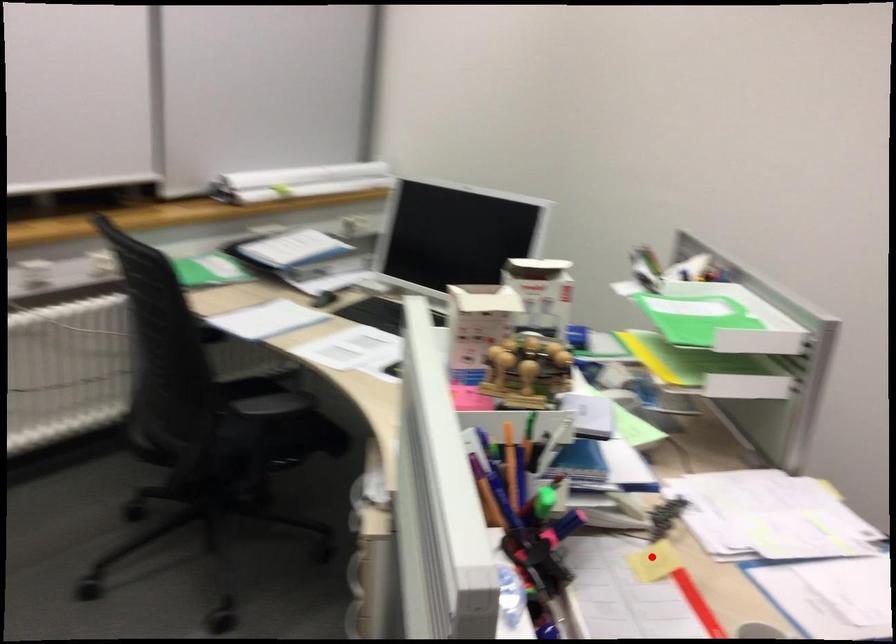
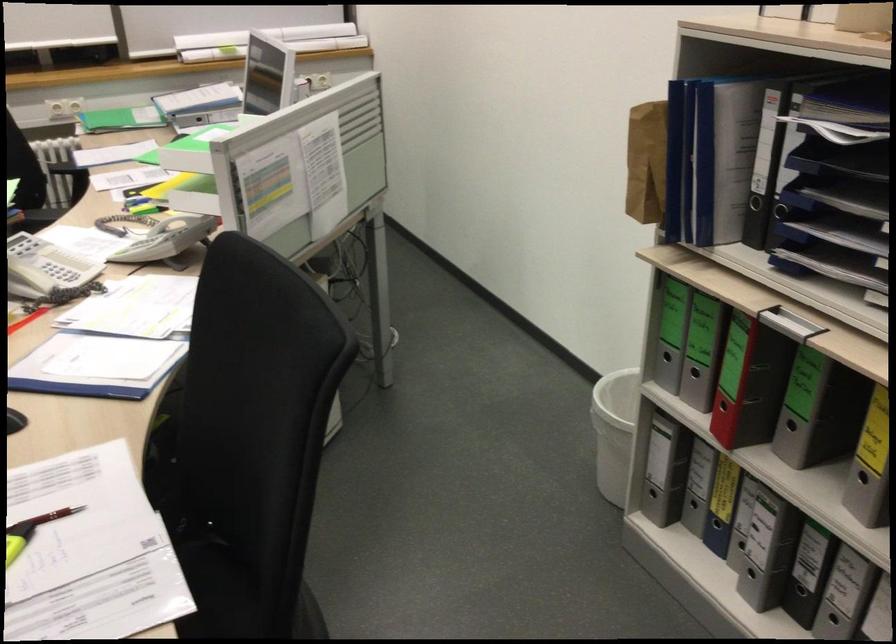
Question: I am providing you with two images of the same scene from different viewpoints. Image1 has a red point marked. In image2, the corresponding 3D location appears at what relative position? Reply with the corresponding letter.

Choices:
 (A) Closer
 (B) Farther

Answer: (B)